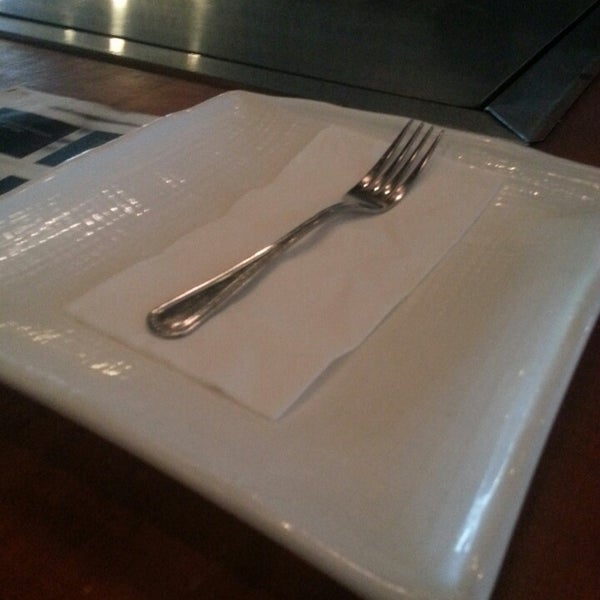
I want to click on wooden table in front of plate, so click(x=103, y=529).